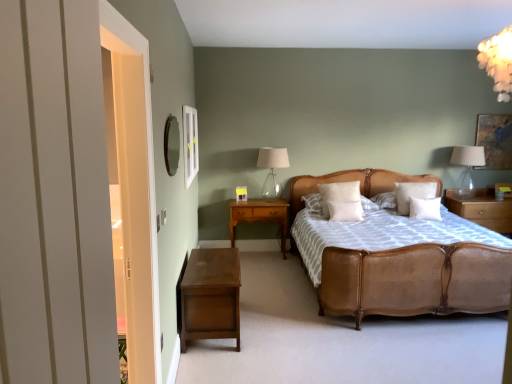
The image size is (512, 384). Describe the element at coordinates (259, 216) in the screenshot. I see `light brown wood nightstand at center left, arranged as the 2th nightstand when viewed from the right` at that location.

Looking at this image, measure the distance between white glossy frame at upper left and camera.

The distance of white glossy frame at upper left from camera is 11.26 feet.

This screenshot has height=384, width=512. What are the coordinates of `clear glass table lamp at center, arranged as the 2th table lamp when viewed from the right` in the screenshot? It's located at (272, 170).

Measure the distance between point (110, 228) and camera.

They are 27.24 inches apart.

Measure the distance between clear glass table lamp at upper right, arranged as the 2th table lamp when viewed from the left, and camera.

clear glass table lamp at upper right, arranged as the 2th table lamp when viewed from the left, and camera are 18.44 feet apart from each other.

Measure the distance between point (470, 167) and camera.

Point (470, 167) is 5.75 meters from camera.

Where is `light brown wood nightstand at center left, arranged as the 2th nightstand when viewed from the right`? The height and width of the screenshot is (384, 512). light brown wood nightstand at center left, arranged as the 2th nightstand when viewed from the right is located at coordinates (259, 216).

Which of these two, wooden mirror at upper left or matte gold picture frame at upper right, is smaller?

With smaller size is matte gold picture frame at upper right.

In terms of height, does wooden mirror at upper left look taller or shorter compared to matte gold picture frame at upper right?

In the image, wooden mirror at upper left appears to be shorter than matte gold picture frame at upper right.

Does wooden mirror at upper left turn towards matte gold picture frame at upper right?

No, wooden mirror at upper left is not turned towards matte gold picture frame at upper right.

Is wooden mirror at upper left at the back of white glossy frame at upper left?

No, white glossy frame at upper left's orientation is not away from wooden mirror at upper left.

Does white glossy frame at upper left contain wooden mirror at upper left?

No.

Does white glossy frame at upper left come behind wooden mirror at upper left?

Yes, white glossy frame at upper left is behind wooden mirror at upper left.

Is white glossy frame at upper left taller or shorter than wooden mirror at upper left?

Considering their sizes, white glossy frame at upper left has more height than wooden mirror at upper left.

Find the location of `nightstand that is on the right side of white soft pillow at upper right, the third pillow when ordered from left to right`. nightstand that is on the right side of white soft pillow at upper right, the third pillow when ordered from left to right is located at coordinates (482, 209).

Which is less distant, (410, 192) or (506, 199)?

The point (410, 192) is closer.

Is white soft pillow at upper right, the third pillow when ordered from left to right, positioned far away from wooden nightstand at right, the 1th nightstand in the right-to-left sequence?

Actually, white soft pillow at upper right, the third pillow when ordered from left to right, and wooden nightstand at right, the 1th nightstand in the right-to-left sequence, are a little close together.

Is wooden nightstand at right, the 1th nightstand in the right-to-left sequence, next to light brown wood nightstand at center left, acting as the second nightstand starting from the back, and touching it?

No.

Is wooden nightstand at right, acting as the third nightstand starting from the left, shorter than light brown wood nightstand at center left, arranged as the 2th nightstand when viewed from the right?

Indeed, wooden nightstand at right, acting as the third nightstand starting from the left, has a lesser height compared to light brown wood nightstand at center left, arranged as the 2th nightstand when viewed from the right.

Can you confirm if wooden nightstand at right, arranged as the 3th nightstand when viewed from the front, is bigger than light brown wood nightstand at center left, positioned as the second nightstand in left-to-right order?

Indeed, wooden nightstand at right, arranged as the 3th nightstand when viewed from the front, has a larger size compared to light brown wood nightstand at center left, positioned as the second nightstand in left-to-right order.

Measure the distance from white wood door at left to matte gold picture frame at upper right.

The distance of white wood door at left from matte gold picture frame at upper right is 17.18 feet.

Which is more to the left, white wood door at left or matte gold picture frame at upper right?

From the viewer's perspective, white wood door at left appears more on the left side.

Is white wood door at left spatially inside matte gold picture frame at upper right, or outside of it?

white wood door at left is located beyond the bounds of matte gold picture frame at upper right.

Who is taller, white wood door at left or matte gold picture frame at upper right?

With more height is white wood door at left.

Considering the relative positions of wooden mirror at upper left and white soft pillow at center, acting as the fourth pillow starting from the left, in the image provided, is wooden mirror at upper left to the right of white soft pillow at center, acting as the fourth pillow starting from the left, from the viewer's perspective?

In fact, wooden mirror at upper left is to the left of white soft pillow at center, acting as the fourth pillow starting from the left.

In the image, is wooden mirror at upper left positioned in front of or behind white soft pillow at center, acting as the fourth pillow starting from the left?

wooden mirror at upper left is positioned closer to the viewer than white soft pillow at center, acting as the fourth pillow starting from the left.

Is point (168, 160) closer or farther from the camera than point (418, 206)?

Point (168, 160) is closer to the camera than point (418, 206).

Which is behind, white wood door at left or wooden nightstand at right, acting as the third nightstand starting from the left?

wooden nightstand at right, acting as the third nightstand starting from the left, is further from the camera.

Is white wood door at left looking in the opposite direction of wooden nightstand at right, acting as the third nightstand starting from the left?

No, wooden nightstand at right, acting as the third nightstand starting from the left, is not at the back of white wood door at left.

Considering the sizes of white wood door at left and wooden nightstand at right, acting as the third nightstand starting from the left, in the image, is white wood door at left wider or thinner than wooden nightstand at right, acting as the third nightstand starting from the left,?

white wood door at left is thinner than wooden nightstand at right, acting as the third nightstand starting from the left.

Is white wood door at left at the right side of wooden nightstand at right, the 1th nightstand in the right-to-left sequence?

Incorrect, white wood door at left is not on the right side of wooden nightstand at right, the 1th nightstand in the right-to-left sequence.

Identify the location of picture frame that is under the wooden mirror at upper left (from a real-world perspective). [x=495, y=140].

Identify the location of mirror above the white glossy frame at upper left (from a real-world perspective). The height and width of the screenshot is (384, 512). (170, 145).

When comparing their distances from woven rattan bed at center, does light brown wood nightstand at center left, arranged as the 2th nightstand when viewed from the right, or white wood door at left seem further?

The object further to woven rattan bed at center is white wood door at left.

Based on their spatial positions, is matte gold picture frame at upper right or white soft pillow at upper right, placed as the 2th pillow when sorted from right to left, closer to clear glass table lamp at center, arranged as the 2th table lamp when viewed from the right?

Among the two, white soft pillow at upper right, placed as the 2th pillow when sorted from right to left, is located nearer to clear glass table lamp at center, arranged as the 2th table lamp when viewed from the right.

Which object lies further to the anchor point white wood door at left, matte gold picture frame at upper right or woven rattan bed at center?

The object further to white wood door at left is matte gold picture frame at upper right.

Which object lies further to the anchor point white soft pillow at center, acting as the fourth pillow starting from the left, white wood door at left or light brown wood nightstand at center left, placed as the 2th nightstand when sorted from front to back?

white wood door at left.

Estimate the real-world distances between objects in this image. Which object is further from wooden nightstand at right, acting as the third nightstand starting from the left, white soft pillow at center, acting as the fourth pillow starting from the left, or white soft pillow at upper right, placed as the 2th pillow when sorted from right to left?

white soft pillow at center, acting as the fourth pillow starting from the left.

Considering their positions, is matte gold picture frame at upper right positioned closer to wooden nightstand at right, acting as the third nightstand starting from the left, than white soft pillow at center, acting as the fourth pillow starting from the left?

Based on the image, matte gold picture frame at upper right appears to be nearer to wooden nightstand at right, acting as the third nightstand starting from the left.

Looking at the image, which one is located closer to white soft pillow at upper right, placed as the 2th pillow when sorted from right to left, matte gold picture frame at upper right or dark brown wood nightstand at lower left, which is the third nightstand from right to left?

The object closer to white soft pillow at upper right, placed as the 2th pillow when sorted from right to left, is matte gold picture frame at upper right.

Based on their spatial positions, is clear glass table lamp at upper right, arranged as the 2th table lamp when viewed from the left, or white soft pillow at center, which ranks as the second pillow in left-to-right order, closer to woven rattan bed at center?

white soft pillow at center, which ranks as the second pillow in left-to-right order.

Where is `table lamp situated between white soft pillow at center, which ranks as the second pillow in left-to-right order, and wooden nightstand at right, arranged as the 3th nightstand when viewed from the front, from left to right`? The height and width of the screenshot is (384, 512). table lamp situated between white soft pillow at center, which ranks as the second pillow in left-to-right order, and wooden nightstand at right, arranged as the 3th nightstand when viewed from the front, from left to right is located at coordinates (467, 167).

At what (x,y) coordinates should I click in order to perform the action: click on table lamp between woven rattan bed at center and light brown wood nightstand at center left, placed as the 2th nightstand when sorted from front to back, along the z-axis. Please return your answer as a coordinate pair (x, y). Image resolution: width=512 pixels, height=384 pixels. Looking at the image, I should click on (272, 170).

Locate an element on the screen. bed between white wood door at left and wooden nightstand at right, the 1th nightstand in the right-to-left sequence, in the front-back direction is located at coordinates (415, 280).

The image size is (512, 384). Find the location of `nightstand located between white wood door at left and woven rattan bed at center in the depth direction`. nightstand located between white wood door at left and woven rattan bed at center in the depth direction is located at coordinates (211, 296).